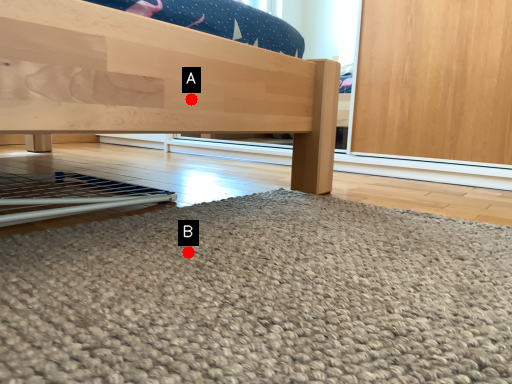
Question: Two points are circled on the image, labeled by A and B beside each circle. Among these points, which one is farthest from the camera?

Choices:
 (A) A is further
 (B) B is further

Answer: (A)